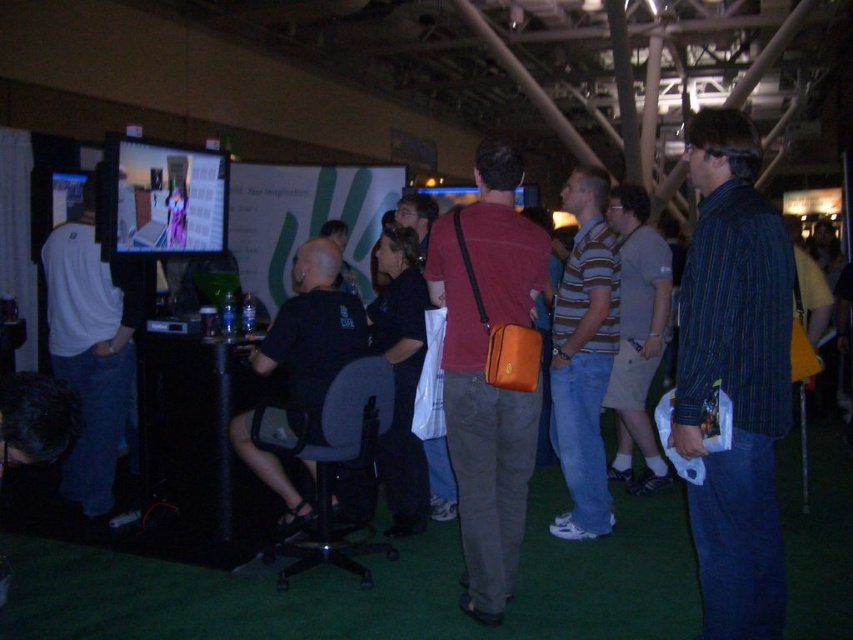
Can you confirm if white matte shirt at left is taller than black fabric shirt at center?

Yes.

Is white matte shirt at left shorter than black fabric shirt at center?

No.

Is point (62, 372) in front of point (300, 417)?

No, (62, 372) is behind (300, 417).

Image resolution: width=853 pixels, height=640 pixels. Identify the location of white matte shirt at left. (91, 346).

Does matte orange bag at center appear under black fabric shirt at center?

No.

Does point (517, 292) come behind point (335, 289)?

No.

Locate an element on the screen. The width and height of the screenshot is (853, 640). matte orange bag at center is located at coordinates (485, 371).

Is matte orange bag at center wider than gray cotton t-shirt at center?

Correct, the width of matte orange bag at center exceeds that of gray cotton t-shirt at center.

This screenshot has width=853, height=640. I want to click on matte orange bag at center, so click(485, 371).